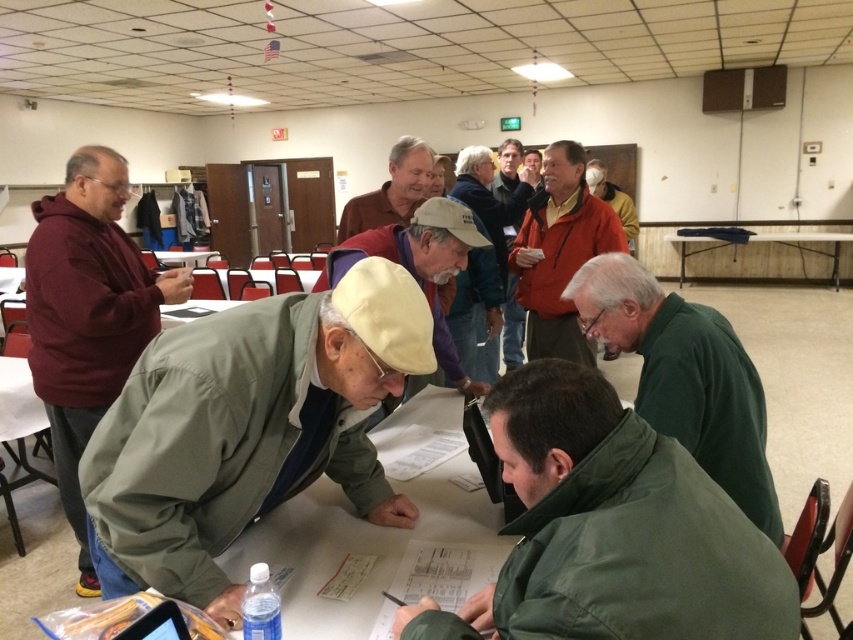
Question: Considering the real-world distances, which object is farthest from the orange softshell jacket at upper right?

Choices:
 (A) khaki cotton jacket at center
 (B) white plastic table at lower left
 (C) yellow fabric cap at center
 (D) wooden table at center

Answer: (D)

Question: Considering the real-world distances, which object is farthest from the green matte jacket at center?

Choices:
 (A) green matte jacket at lower right
 (B) white plastic table at lower left
 (C) wooden table at center

Answer: (C)

Question: Observing the image, what is the correct spatial positioning of orange softshell jacket at upper right in reference to matte brown shirt at upper center?

Choices:
 (A) above
 (B) below

Answer: (B)

Question: Is the position of yellow fabric cap at center more distant than that of orange jacket at upper center?

Choices:
 (A) no
 (B) yes

Answer: (A)

Question: Is orange softshell jacket at upper right behind orange jacket at upper center?

Choices:
 (A) no
 (B) yes

Answer: (A)

Question: Which is nearer to the yellow fabric cap at center?

Choices:
 (A) orange softshell jacket at upper right
 (B) white plastic table at lower left
 (C) orange jacket at upper center

Answer: (A)